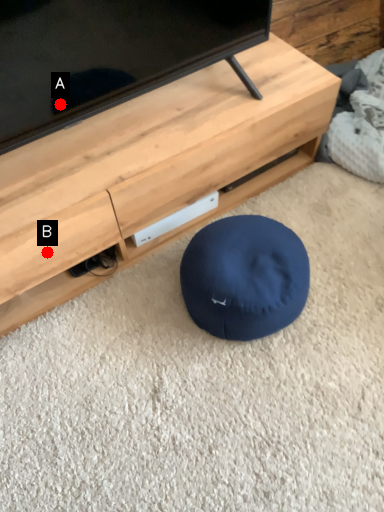
Question: Two points are circled on the image, labeled by A and B beside each circle. Which of the following is the farthest from the observer?

Choices:
 (A) A is further
 (B) B is further

Answer: (B)